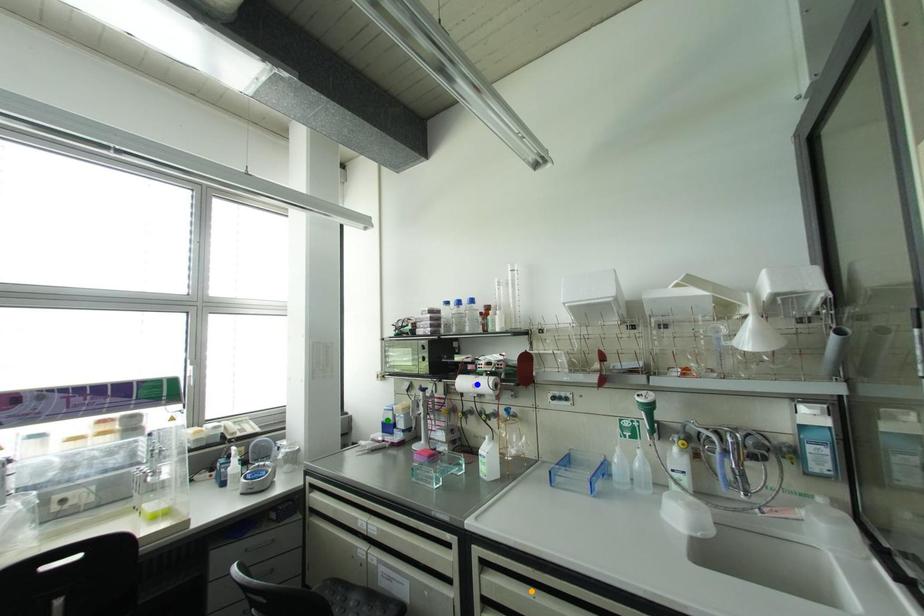
Order these from nearest to farthest:
orange point
green point
blue point

orange point → blue point → green point